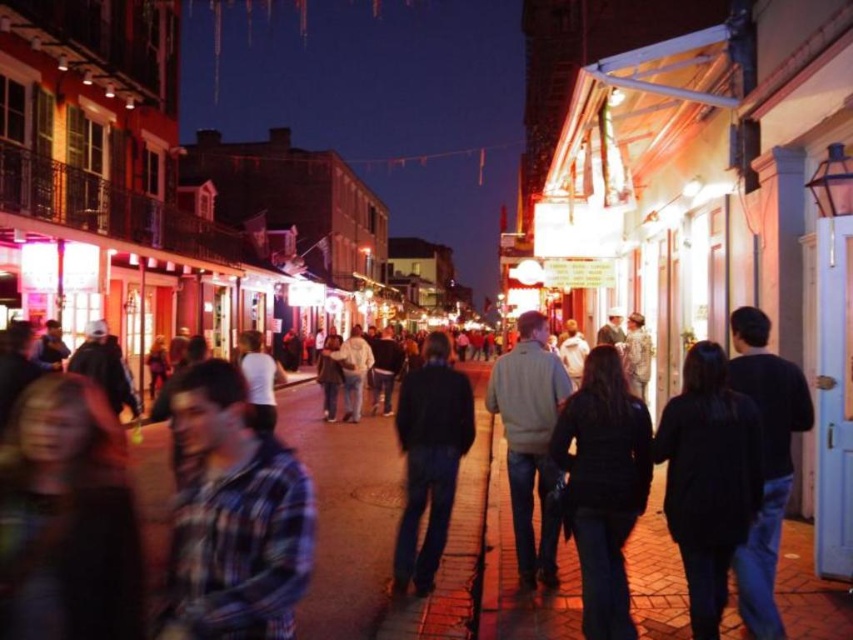
Can you confirm if plaid fabric shirt at center is bigger than dark blue jeans at center?

No, plaid fabric shirt at center is not bigger than dark blue jeans at center.

Does plaid fabric shirt at center have a smaller size compared to dark blue jeans at center?

Yes.

Is point (227, 369) behind point (410, 420)?

No, (227, 369) is in front of (410, 420).

At what (x,y) coordinates should I click in order to perform the action: click on plaid fabric shirt at center. Please return your answer as a coordinate pair (x, y). The width and height of the screenshot is (853, 640). Looking at the image, I should click on [233, 516].